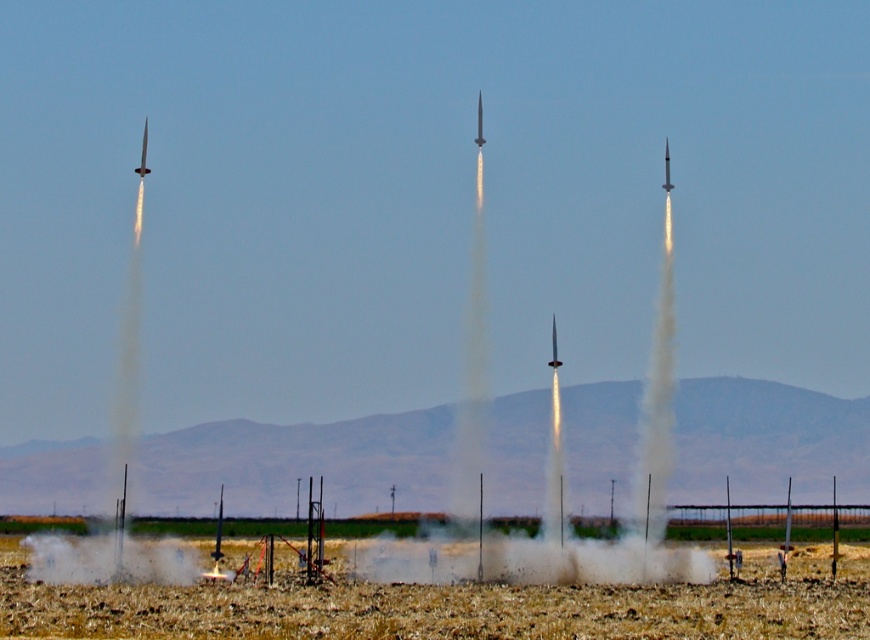
Locate an element on the screen. white matte smoke at left is located at coordinates coord(116,472).

Is white matte smoke at left in front of shiny metallic missile at center?

Yes, white matte smoke at left is closer to the viewer.

You are a GUI agent. You are given a task and a screenshot of the screen. Output one action in this format:
    pyautogui.click(x=<x>, y=<y>)
    Task: Click on the white matte smoke at left
    Image resolution: width=870 pixels, height=640 pixels.
    Given the screenshot: What is the action you would take?
    pyautogui.click(x=116, y=472)

Between matte silver rocket at center and shiny silver rocket at center, which one appears on the left side from the viewer's perspective?

Positioned to the left is matte silver rocket at center.

Can you confirm if matte silver rocket at center is taller than shiny silver rocket at center?

No.

Which is in front, point (556, 362) or point (666, 161)?

Point (556, 362) is in front.

Find the location of a particular element. matte silver rocket at center is located at coordinates (554, 346).

Is white vapor rocket at center taller than shiny silver rocket at center?

Yes, white vapor rocket at center is taller than shiny silver rocket at center.

Who is more distant from viewer, (x=477, y=257) or (x=667, y=168)?

Positioned behind is point (x=667, y=168).

What are the coordinates of `white vapor rocket at center` in the screenshot? It's located at (567, 500).